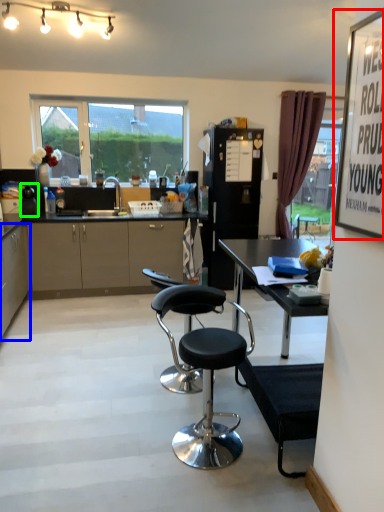
Question: Estimate the real-world distances between objects in this image. Which object is closer to bulletin board (highlighted by a red box), cabinetry (highlighted by a blue box) or appliance (highlighted by a green box)?

Choices:
 (A) cabinetry
 (B) appliance

Answer: (A)